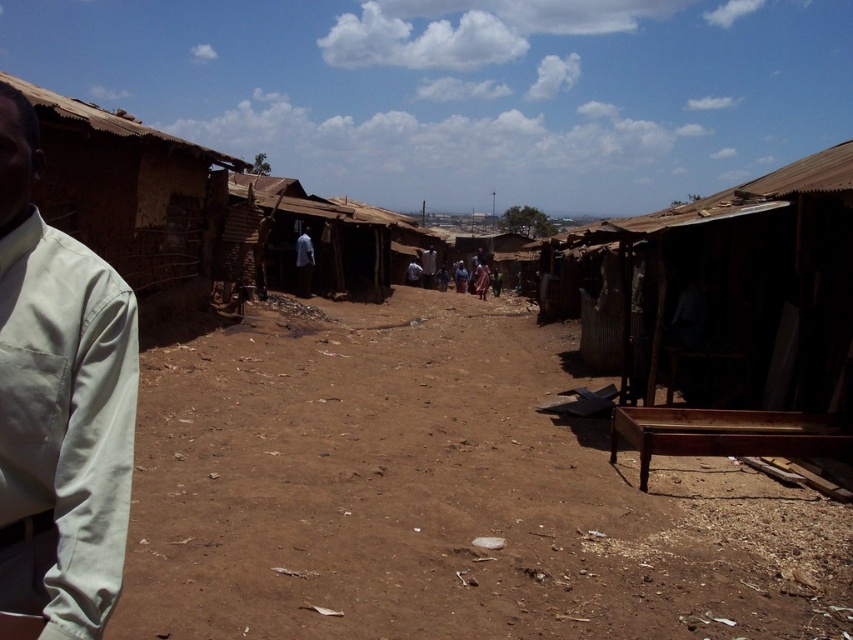
You are standing at the entrance of the settlement and want to locate the brown dirt field at center. According to the coordinates provided, in which direction should you walk to reach it?

The brown dirt field at center is located at coordinates point [439,497], so you should walk forward along the dirt path towards the center of the settlement to reach it.

You are standing at the origin point of the image. You want to walk to the brown dirt field at center. In which direction should you move relative to your current position?

The brown dirt field at center is located at coordinates point (439, 497), so you should move towards the right and slightly forward to reach it.

You are standing at the edge of the dirt path and see the brown dirt field at center and the light brown wooden chair at center. Which object is closer to the ground?

The brown dirt field at center is located below the light brown wooden chair at center, so the brown dirt field at center is closer to the ground.